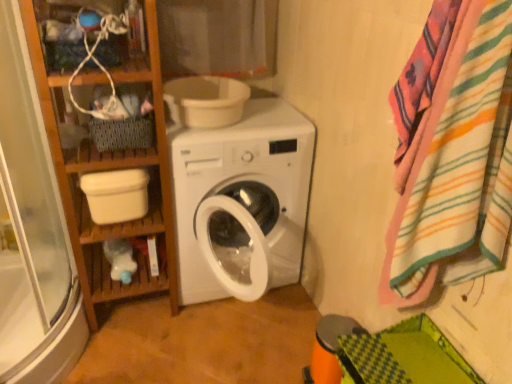
Question: From the image's perspective, would you say wooden shelf at upper left is positioned over woven fabric basket at upper left?

Choices:
 (A) no
 (B) yes

Answer: (B)

Question: Is wooden shelf at upper left to the right of woven fabric basket at upper left from the viewer's perspective?

Choices:
 (A) yes
 (B) no

Answer: (B)

Question: Considering the relative sizes of wooden shelf at upper left and woven fabric basket at upper left in the image provided, is wooden shelf at upper left wider than woven fabric basket at upper left?

Choices:
 (A) no
 (B) yes

Answer: (B)

Question: Are wooden shelf at upper left and woven fabric basket at upper left far apart?

Choices:
 (A) yes
 (B) no

Answer: (B)

Question: Would you say woven fabric basket at upper left is part of wooden shelf at upper left's contents?

Choices:
 (A) no
 (B) yes

Answer: (A)

Question: Is wooden bookshelf at left wider or thinner than wooden shelf at upper left?

Choices:
 (A) wide
 (B) thin

Answer: (A)

Question: In terms of height, does wooden bookshelf at left look taller or shorter compared to wooden shelf at upper left?

Choices:
 (A) short
 (B) tall

Answer: (B)

Question: Considering the positions of point (96, 254) and point (148, 21), is point (96, 254) closer or farther from the camera than point (148, 21)?

Choices:
 (A) farther
 (B) closer

Answer: (A)

Question: Would you say wooden bookshelf at left is to the left or to the right of wooden shelf at upper left in the picture?

Choices:
 (A) left
 (B) right

Answer: (B)

Question: Is white plastic bucket at lower left, which is the 1th toilet bowl in left-to-right order, spatially inside cotton curtain at upper center, or outside of it?

Choices:
 (A) inside
 (B) outside

Answer: (B)

Question: Considering the relative positions of white plastic bucket at lower left, arranged as the first toilet bowl when ordered from the bottom, and cotton curtain at upper center in the image provided, is white plastic bucket at lower left, arranged as the first toilet bowl when ordered from the bottom, to the left or to the right of cotton curtain at upper center?

Choices:
 (A) left
 (B) right

Answer: (A)

Question: From the image's perspective, is white plastic bucket at lower left, which is the 1th toilet bowl in left-to-right order, above or below cotton curtain at upper center?

Choices:
 (A) above
 (B) below

Answer: (B)

Question: In the image, is white plastic bucket at lower left, arranged as the first toilet bowl when ordered from the bottom, positioned in front of or behind cotton curtain at upper center?

Choices:
 (A) behind
 (B) front

Answer: (B)

Question: Considering the positions of woven fabric basket at upper left and white plastic bucket at lower left, which is the 1th toilet bowl in left-to-right order, in the image, is woven fabric basket at upper left wider or thinner than white plastic bucket at lower left, which is the 1th toilet bowl in left-to-right order,?

Choices:
 (A) thin
 (B) wide

Answer: (A)

Question: In terms of height, does woven fabric basket at upper left look taller or shorter compared to white plastic bucket at lower left, which is the second toilet bowl from top to bottom?

Choices:
 (A) tall
 (B) short

Answer: (B)